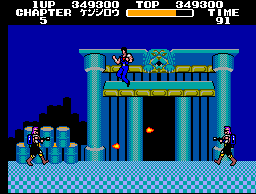
Where is `doorway`? The width and height of the screenshot is (256, 194). doorway is located at coordinates (154, 111).